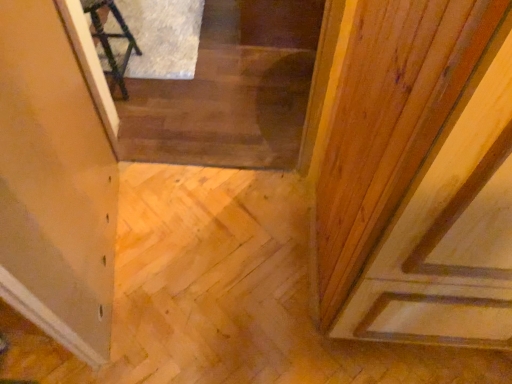
Question: Is wooden stairs at center to the left or to the right of transparent glass door at upper left in the image?

Choices:
 (A) right
 (B) left

Answer: (A)

Question: From the image's perspective, relative to transparent glass door at upper left, is wooden stairs at center above or below?

Choices:
 (A) below
 (B) above

Answer: (B)

Question: Which object is the closest to the wooden stairs at center?

Choices:
 (A) transparent glass door at upper left
 (B) dark wood chair at upper left

Answer: (B)

Question: Which of these objects is positioned closest to the wooden stairs at center?

Choices:
 (A) transparent glass door at upper left
 (B) dark wood chair at upper left

Answer: (B)